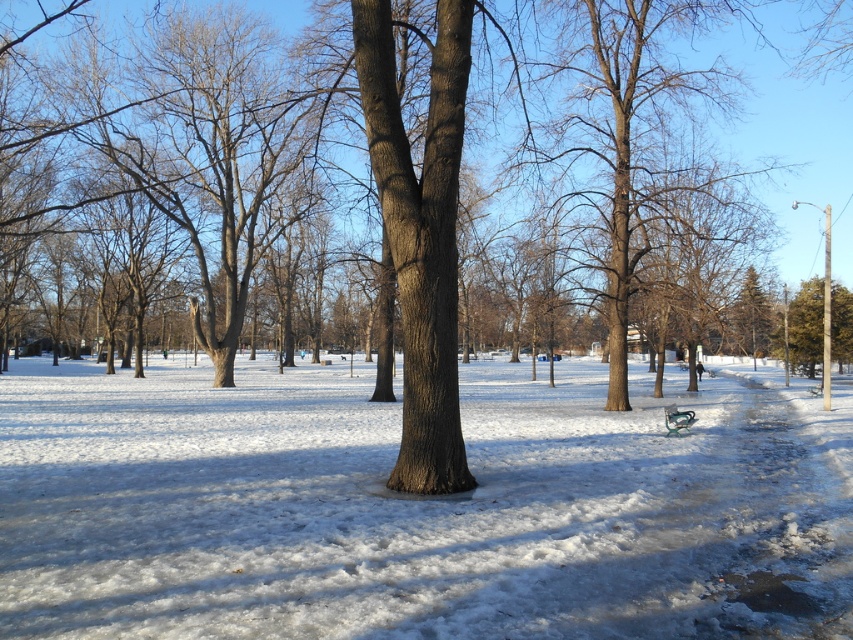
You are a photographer standing in the snowy park. You want to take a photo that includes both the brown bark tree at center and the green textured evergreen tree at right. Based on their positions, which tree will appear closer to the camera in the photo?

The brown bark tree at center will appear closer to the camera because it is positioned in front of the green textured evergreen tree at right.

You are standing at the center of the snowy park and want to reach the green textured evergreen tree at right. What direction should you head towards?

The green textured evergreen tree at right is located at point 0.497 on the x axis and 0.879 on the y axis. Since you are at the center, you should head towards the right and slightly forward to reach it.

You are standing in the winter park scene and want to walk from the point at coordinates point (759, 353) to point (665, 406). Which direction should you move to get closer to your destination?

You should move towards the direction away from you because point (665, 406) is closer to you than point (759, 353).